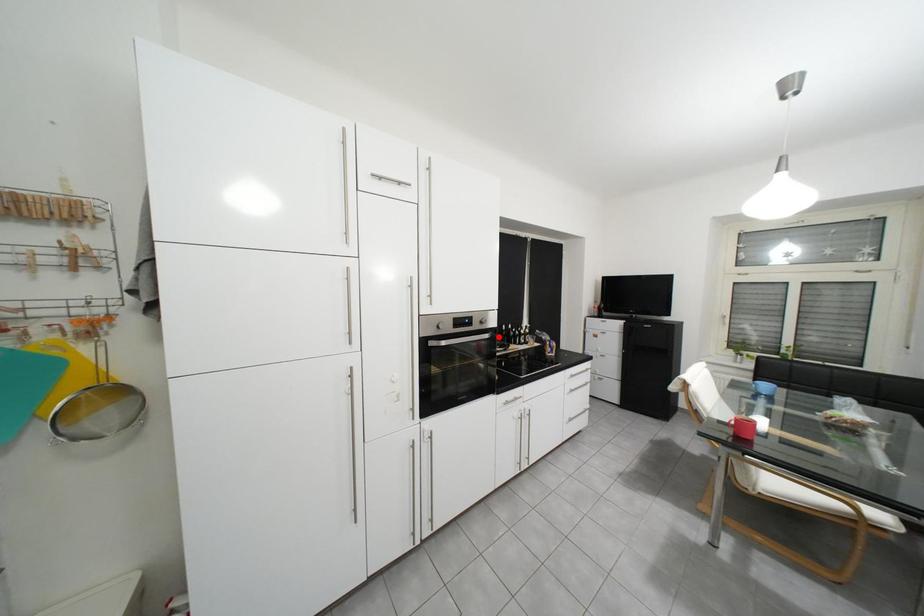
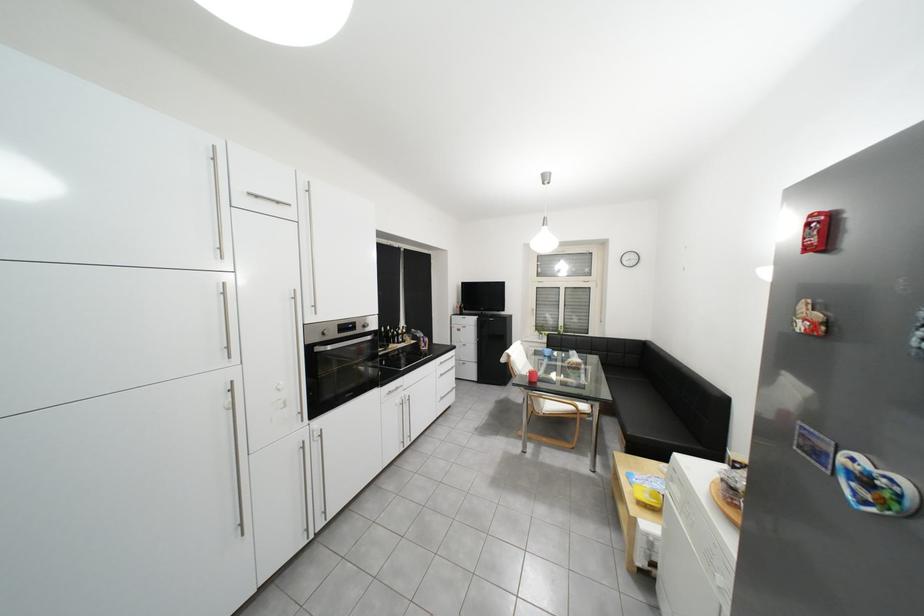
Where in the second image is the point corresponding to the highlighted location from the first image?

(381, 339)